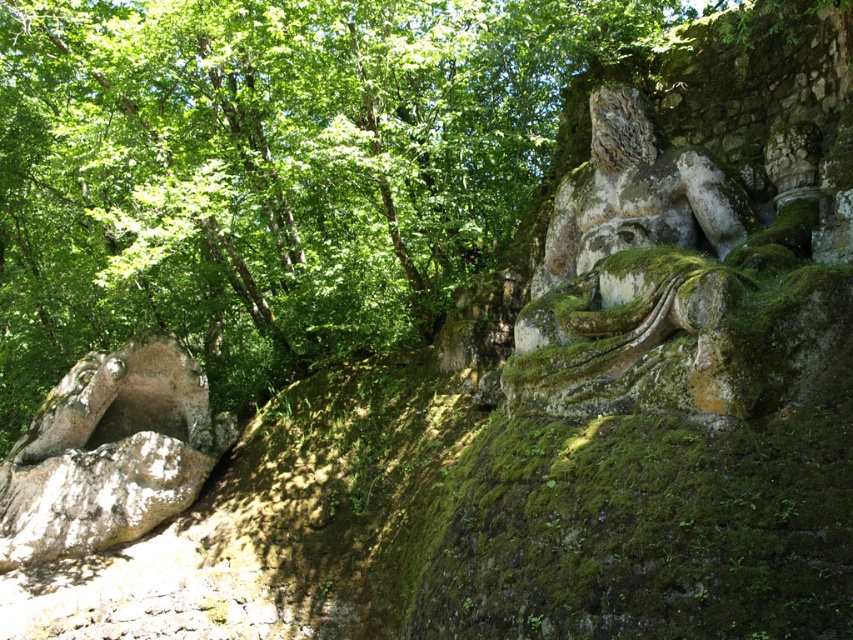
You are a landscape architect assessing the placement of the rough textured rock at left and the green mossy stone statue at upper right. Based on their heights, which one would cast a longer shadow during midday when the sun is directly overhead?

The rough textured rock at left is taller than the green mossy stone statue at upper right, so it would cast a longer shadow during midday when the sun is directly overhead.

You are standing at the entrance of the park and want to take a photo of the point at coordinates (549,388). If your camera has a maximum focus range of 10 meters, will it be able to focus on that point?

The distance of point (549,388) from the viewer is 9.58 meters, which is within the camera maximum focus range of 10 meters. Therefore, the camera can focus on that point.

You are a landscape photographer planning to capture both the rough textured rock at left and the green mossy stone statue at upper right in a single frame. Based on their positions, which object will appear closer to the camera in the photo?

The rough textured rock at left will appear closer to the camera in the photo because it is further to the viewer than the green mossy stone statue at upper right, meaning it is positioned nearer to the photographer.